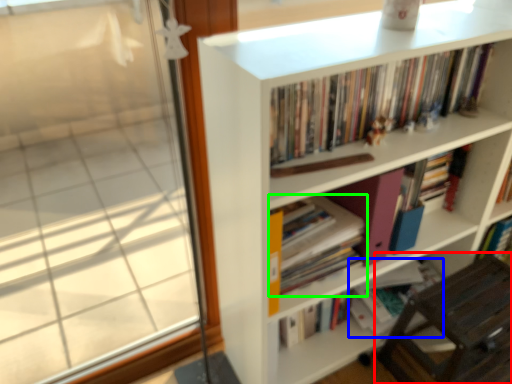
Question: Estimate the real-world distances between objects in this image. Which object is closer to chair (highlighted by a red box), book (highlighted by a blue box) or book (highlighted by a green box)?

Choices:
 (A) book
 (B) book

Answer: (A)